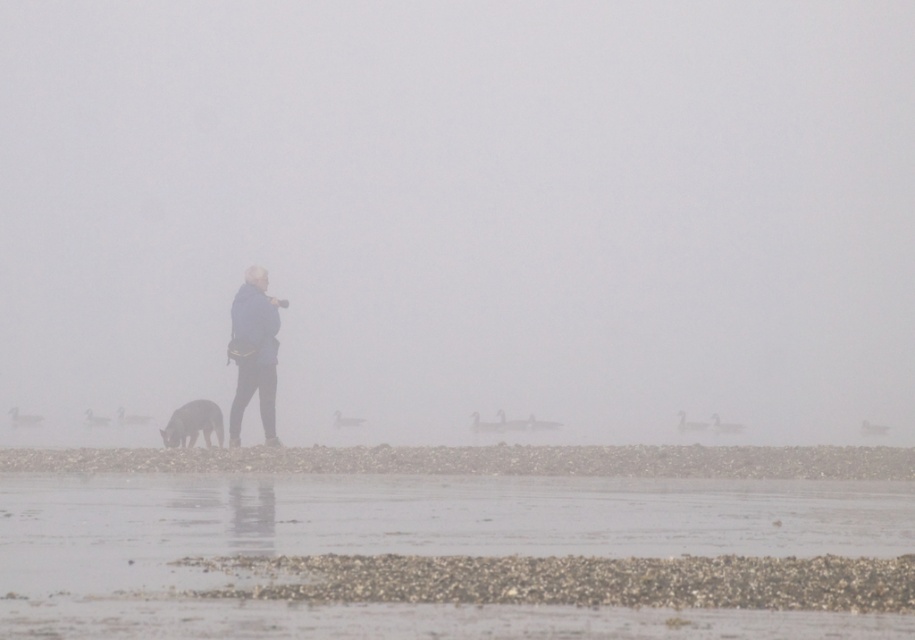
Does foggy atmosphere at center have a greater height compared to smooth pebbles at center?

Correct, foggy atmosphere at center is much taller as smooth pebbles at center.

In the scene shown: Is foggy atmosphere at center positioned behind smooth pebbles at center?

Yes.

The height and width of the screenshot is (640, 915). Find the location of `foggy atmosphere at center`. foggy atmosphere at center is located at coordinates (465, 209).

Is smooth pebbles at center to the right of blue fabric jacket at center from the viewer's perspective?

Yes, smooth pebbles at center is to the right of blue fabric jacket at center.

Does smooth pebbles at center appear on the left side of blue fabric jacket at center?

In fact, smooth pebbles at center is to the right of blue fabric jacket at center.

Does point (813, 497) come in front of point (246, 403)?

Yes.

The image size is (915, 640). Find the location of `smooth pebbles at center`. smooth pebbles at center is located at coordinates (456, 544).

Can you confirm if foggy atmosphere at center is smaller than shiny brown fur at lower left?

Actually, foggy atmosphere at center might be larger than shiny brown fur at lower left.

Measure the distance between point (383, 424) and camera.

Point (383, 424) is 36.04 meters from camera.

Locate an element on the screen. foggy atmosphere at center is located at coordinates (465, 209).